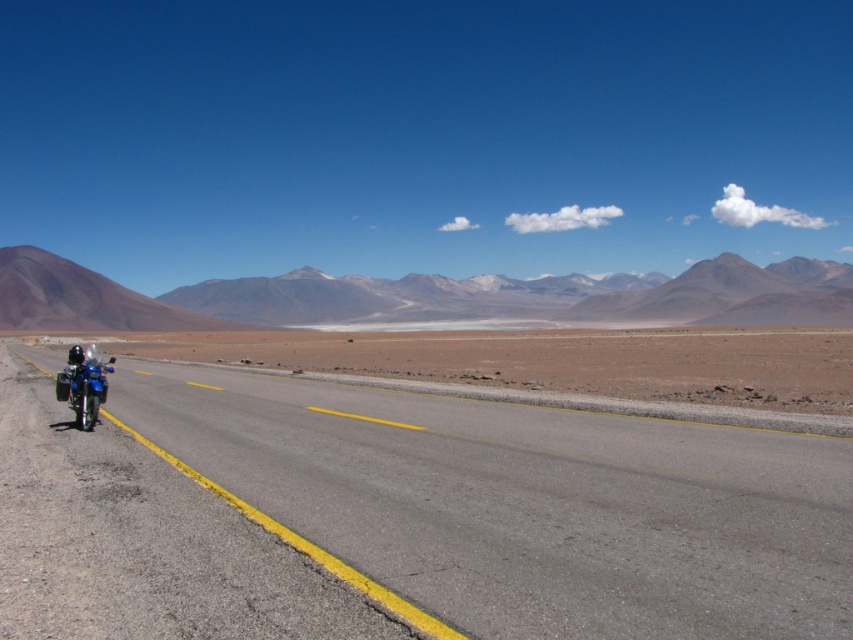
Question: Estimate the real-world distances between objects in this image. Which object is closer to the smooth asphalt road at center?

Choices:
 (A) rustic brown mountain at left
 (B) blue metallic motorbike at left

Answer: (B)

Question: Which point is closer to the camera taking this photo?

Choices:
 (A) (39, 275)
 (B) (625, 604)

Answer: (B)

Question: Does smooth asphalt road at center appear under rustic brown mountain at left?

Choices:
 (A) no
 (B) yes

Answer: (B)

Question: Among these objects, which one is nearest to the camera?

Choices:
 (A) smooth asphalt road at center
 (B) rustic brown mountain at left

Answer: (A)

Question: Can you confirm if rustic brown mountain at left is smaller than blue metallic motorbike at left?

Choices:
 (A) no
 (B) yes

Answer: (A)

Question: Does rustic brown mountain at left appear on the left side of blue metallic motorbike at left?

Choices:
 (A) yes
 (B) no

Answer: (A)